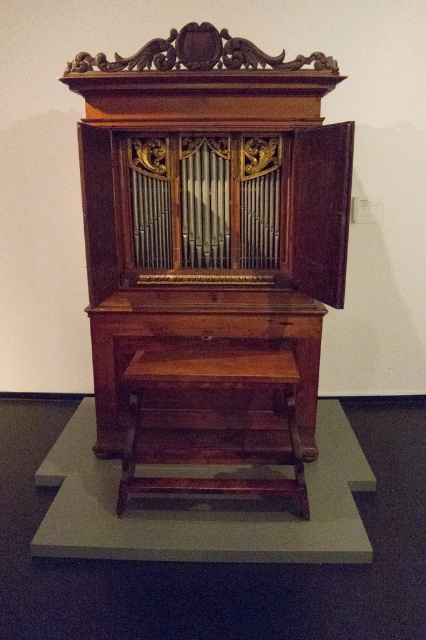
You are a musician who wants to sit on the wooden stool at center to play the polished wood pipe organ at center. Can you comfortably sit on the stool and reach the organ?

The polished wood pipe organ at center is larger in size than wooden stool at center, so yes, you can comfortably sit on the wooden stool at center and reach the organ since the stool is positioned appropriately for playing.

You are standing in front of the antique organ and want to determine the relative positions of two points on it. Which point is closer to you, point (112,262) or point (180,480)?

Point (112,262) is closer to you because it is further to the viewer than point (180,480).

You are a musician who wants to play the polished wood pipe organ at center. You see the wooden stool at center nearby. Is the stool positioned under the organ where you can sit and reach the organ?

Yes, the polished wood pipe organ at center is above the wooden stool at center, so the stool is positioned under the organ where you can sit and reach it.